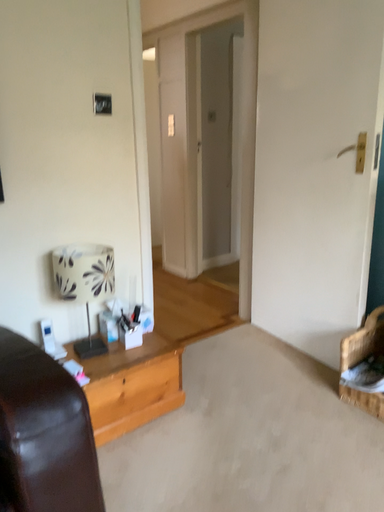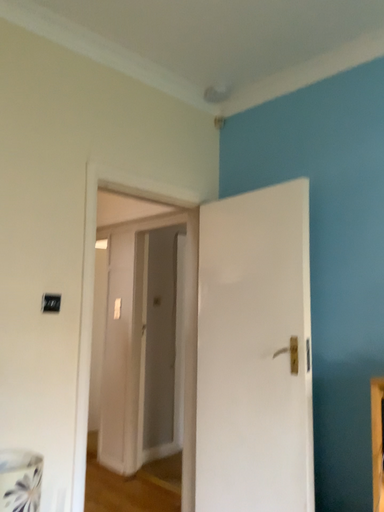
Question: Which way did the camera rotate in the video?

Choices:
 (A) rotated right
 (B) rotated left

Answer: (A)